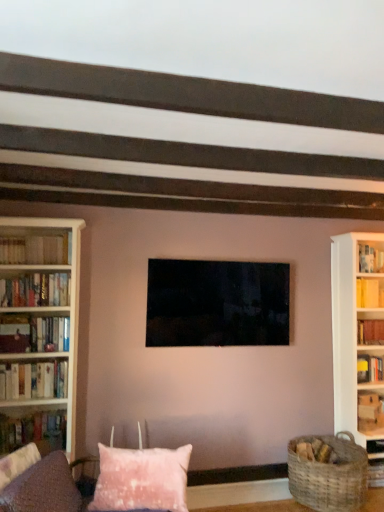
Question: Does pink fabric couch at lower center have a lesser width compared to hardcover books at left, the second book when ordered from bottom to top?

Choices:
 (A) yes
 (B) no

Answer: (B)

Question: From a real-world perspective, is pink fabric couch at lower center over hardcover books at left, which is the fifth book from top to bottom?

Choices:
 (A) no
 (B) yes

Answer: (A)

Question: Does pink fabric couch at lower center appear on the left side of hardcover books at left, which is the fifth book from top to bottom?

Choices:
 (A) no
 (B) yes

Answer: (A)

Question: Is pink fabric couch at lower center looking in the opposite direction of hardcover books at left, the 3th book viewed from the left?

Choices:
 (A) no
 (B) yes

Answer: (A)

Question: Is pink fabric couch at lower center far away from hardcover books at left, which is the fifth book from top to bottom?

Choices:
 (A) no
 (B) yes

Answer: (A)

Question: Is pink fabric couch at lower center in contact with hardcover books at left, placed as the 4th book when sorted from right to left?

Choices:
 (A) yes
 (B) no

Answer: (B)

Question: From a real-world perspective, is wooden bookshelf at right, which is the third book from bottom to top, positioned under pink fluffy pillow at lower center based on gravity?

Choices:
 (A) yes
 (B) no

Answer: (B)

Question: Is wooden bookshelf at right, marked as the 1th book in a right-to-left arrangement, placed right next to pink fluffy pillow at lower center?

Choices:
 (A) no
 (B) yes

Answer: (A)

Question: Is wooden bookshelf at right, the fourth book positioned from the top, in front of pink fluffy pillow at lower center?

Choices:
 (A) no
 (B) yes

Answer: (A)

Question: From a real-world perspective, does wooden bookshelf at right, the sixth book in the left-to-right sequence, stand above pink fluffy pillow at lower center?

Choices:
 (A) yes
 (B) no

Answer: (A)

Question: From the image's perspective, is wooden bookshelf at right, which is the third book from bottom to top, below pink fluffy pillow at lower center?

Choices:
 (A) no
 (B) yes

Answer: (A)

Question: From the image's perspective, is wooden bookshelf at right, marked as the 1th book in a right-to-left arrangement, located above pink fluffy pillow at lower center?

Choices:
 (A) yes
 (B) no

Answer: (A)

Question: Does hardcover books at left, the 5th book when ordered from right to left, have a larger size compared to matte black tv at center?

Choices:
 (A) no
 (B) yes

Answer: (A)